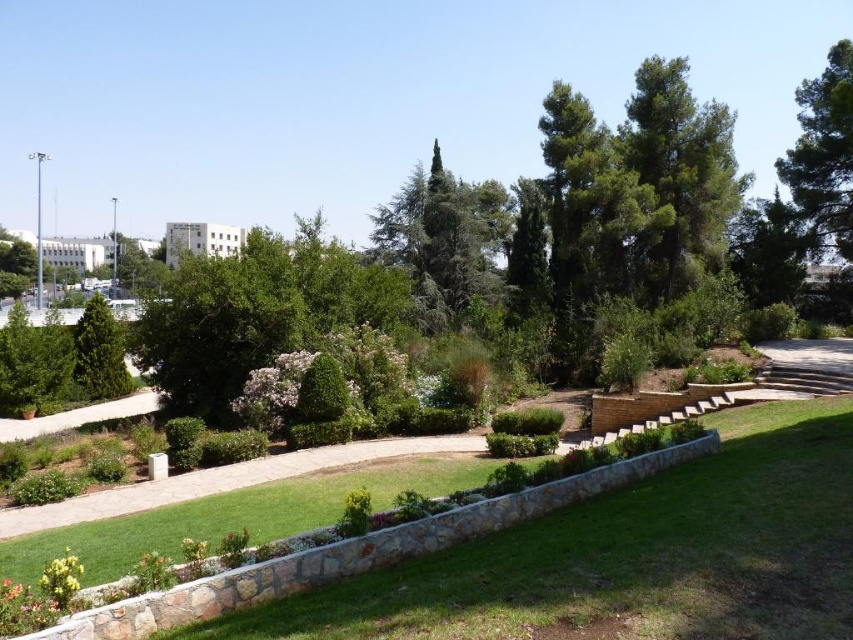
Question: Which of the following is the closest to the observer?

Choices:
 (A) green leafy tree at upper right
 (B) green grass at center
 (C) green needle-like tree at center
 (D) green needle-like at upper center

Answer: (B)

Question: Is green grass at center bigger than green leafy bush at center-left?

Choices:
 (A) no
 (B) yes

Answer: (A)

Question: Which point appears farthest from the camera in this image?

Choices:
 (A) (786, 177)
 (B) (492, 241)
 (C) (76, 376)
 (D) (718, 170)

Answer: (B)

Question: Which point is farther to the camera?

Choices:
 (A) pyautogui.click(x=120, y=388)
 (B) pyautogui.click(x=799, y=216)

Answer: (B)

Question: Does green needle-like at upper center appear on the right side of green needle-like tree at center?

Choices:
 (A) no
 (B) yes

Answer: (B)

Question: Observing the image, what is the correct spatial positioning of green grass at center in reference to green leafy bush at center-left?

Choices:
 (A) below
 (B) above

Answer: (A)